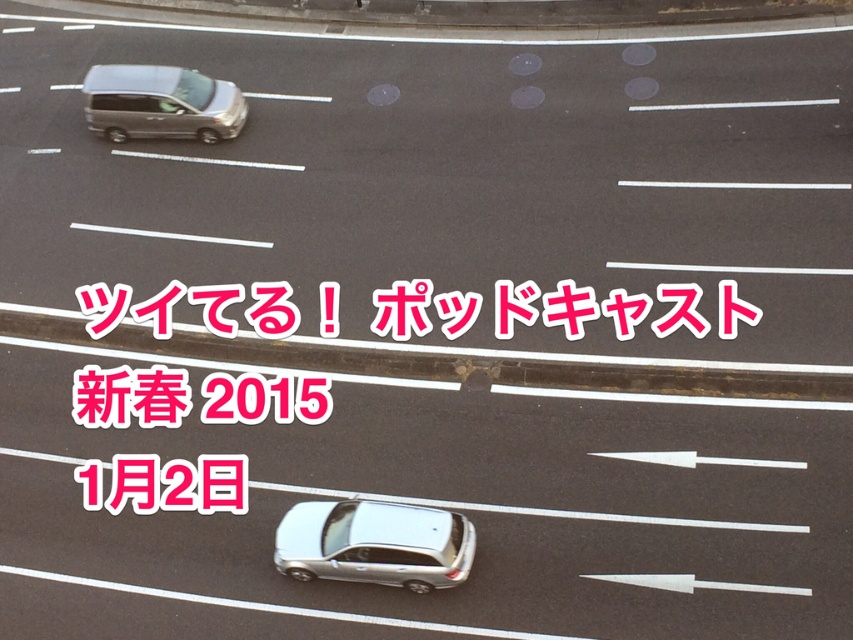
You are a driver approaching the intersection and see the pink glossy text at upper center and the satin silver sedan at lower center. Which object is larger in the image?

The pink glossy text at upper center is bigger than the satin silver sedan at lower center.

You are a driver approaching the intersection and see the pink paper text at center and the satin silver van at upper left. Which object is closer to the center of the road?

The pink paper text at center is closer to the center of the road because it is positioned to the right of the satin silver van at upper left, which is located further to the left side of the road.